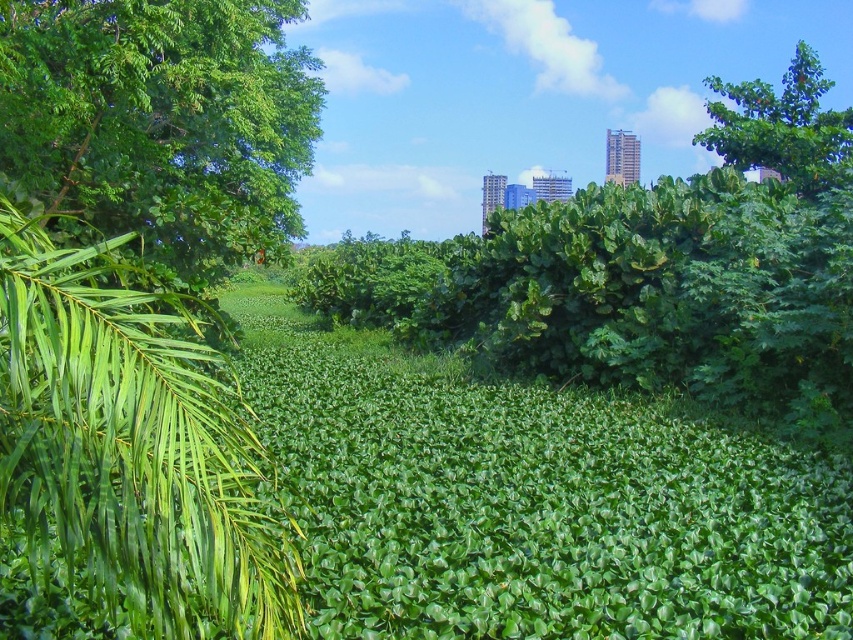
Between green leafy palm at left and green leafy tree at upper right, which one is positioned higher?

green leafy tree at upper right is higher up.

From the picture: Can you confirm if green leafy palm at left is shorter than green leafy tree at upper right?

Indeed, green leafy palm at left has a lesser height compared to green leafy tree at upper right.

Between point (123, 328) and point (738, 93), which one is positioned in front?

Positioned in front is point (123, 328).

You are a GUI agent. You are given a task and a screenshot of the screen. Output one action in this format:
    pyautogui.click(x=<x>, y=<y>)
    Task: Click on the green leafy palm at left
    This screenshot has width=853, height=640.
    Given the screenshot: What is the action you would take?
    pyautogui.click(x=132, y=445)

Who is positioned more to the right, green leafy palm at left or green leafy tree at left?

From the viewer's perspective, green leafy palm at left appears more on the right side.

Which is in front, point (234, 625) or point (154, 192)?

Point (234, 625) is more forward.

This screenshot has height=640, width=853. Identify the location of green leafy palm at left. (132, 445).

Where is `green leafy palm at left`? The image size is (853, 640). green leafy palm at left is located at coordinates (132, 445).

What do you see at coordinates (161, 122) in the screenshot?
I see `green leafy tree at left` at bounding box center [161, 122].

Can you confirm if green leafy tree at left is smaller than green leafy tree at upper right?

Yes, green leafy tree at left is smaller than green leafy tree at upper right.

Who is more distant from viewer, (96,12) or (792,88)?

The point (792,88) is behind.

Where is `green leafy tree at left`? This screenshot has width=853, height=640. green leafy tree at left is located at coordinates (161, 122).